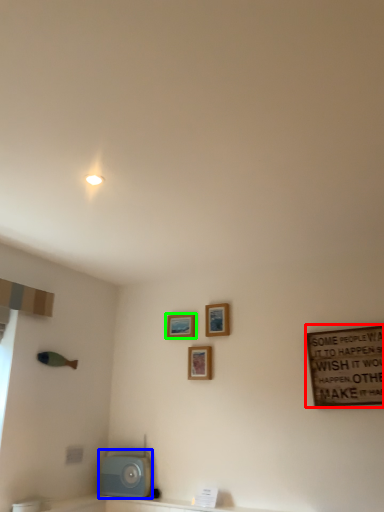
Question: Which object is positioned farthest from bulletin board (highlighted by a red box)? Select from appliance (highlighted by a blue box) and picture frame (highlighted by a green box).

Choices:
 (A) appliance
 (B) picture frame

Answer: (A)